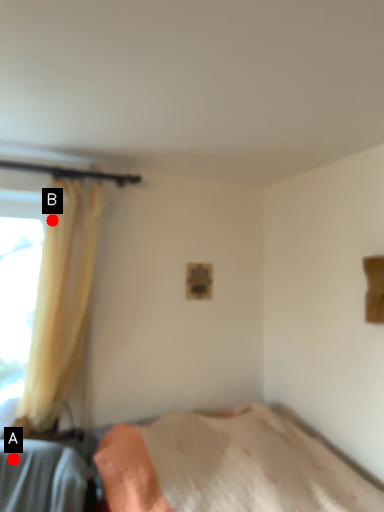
Question: Two points are circled on the image, labeled by A and B beside each circle. Which of the following is the farthest from the observer?

Choices:
 (A) A is further
 (B) B is further

Answer: (B)